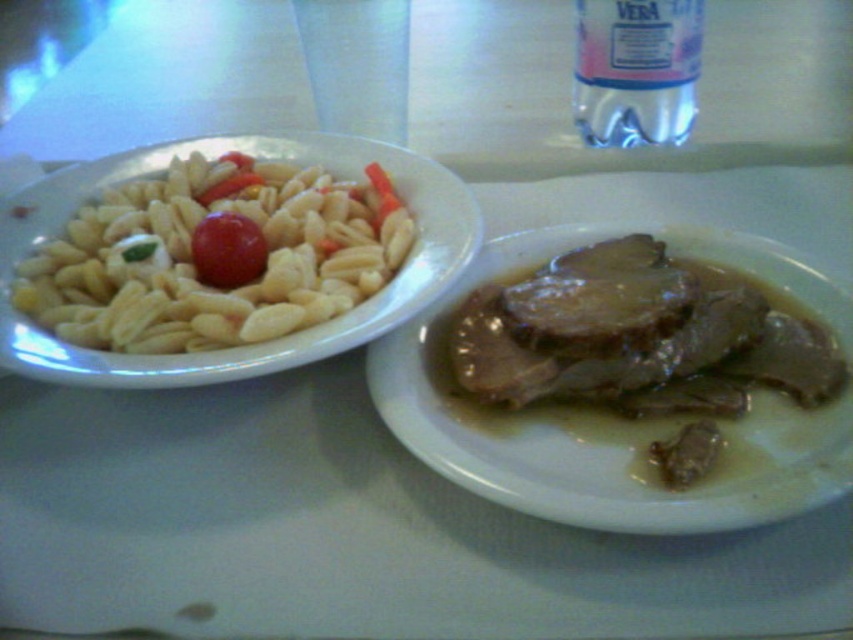
You are a food critic sitting at the table. You need to describe the arrangement of the white matte pasta at left and the red glossy cherry tomato at upper left. Which one is positioned more to the left?

The white matte pasta at left is positioned more to the left than the red glossy cherry tomato at upper left.

You are a food critic evaluating the layout of this meal. The white matte pasta at left is positioned at coordinates 0.416 on the x and 0.230 on the y. How does its placement compare to the steak on the right plate?

The white matte pasta at left is located at point [195,266], which is to the left of the steak on the right plate, indicating it is placed on the left side of the table.

You are a food critic standing 6 feet away from the table. You want to take a photo of the white matte pasta at left. Is the distance sufficient to capture the entire dish in the frame?

The white matte pasta at left is 24.15 inches from camera. Since 24.15 inches is less than 6 feet, the distance is sufficient to capture the entire dish in the frame.